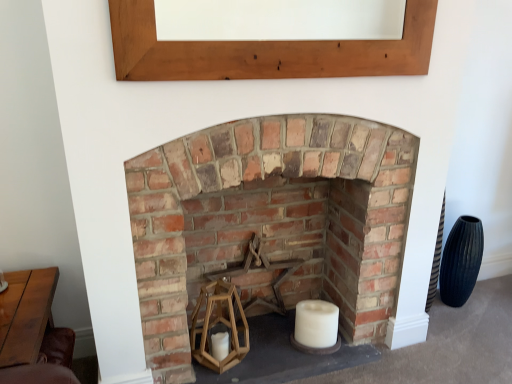
What is the approximate height of rustic brick fireplace at center?

3.91 feet.

Where is `white matte candle at center`? Image resolution: width=512 pixels, height=384 pixels. white matte candle at center is located at coordinates (316, 324).

Measure the distance between point [249,271] and camera.

2.21 meters.

The image size is (512, 384). What do you see at coordinates (260, 271) in the screenshot?
I see `wooden at center` at bounding box center [260, 271].

This screenshot has height=384, width=512. Identify the location of light brown wood at upper center. (264, 51).

From the image's perspective, which one is positioned lower, white matte candle at center or light brown wood at upper center?

white matte candle at center appears lower in the image.

Is white matte candle at center spatially inside light brown wood at upper center, or outside of it?

white matte candle at center exists outside the volume of light brown wood at upper center.

Measure the distance between white matte candle at center and light brown wood at upper center.

A distance of 3.98 feet exists between white matte candle at center and light brown wood at upper center.

Looking at their sizes, would you say white matte candle at center is wider or thinner than light brown wood at upper center?

Considering their sizes, white matte candle at center looks broader than light brown wood at upper center.

From the image's perspective, does rustic brick fireplace at center appear higher than light brown wood at upper center?

Incorrect, from the image's perspective, rustic brick fireplace at center is lower than light brown wood at upper center.

Considering the relative sizes of rustic brick fireplace at center and light brown wood at upper center in the image provided, is rustic brick fireplace at center shorter than light brown wood at upper center?

Incorrect, the height of rustic brick fireplace at center does not fall short of that of light brown wood at upper center.

Image resolution: width=512 pixels, height=384 pixels. I want to click on window frame lying on the right of rustic brick fireplace at center, so click(264, 51).

In the image, is wooden at center on the left side or the right side of rustic brick fireplace at center?

From the image, it's evident that wooden at center is to the left of rustic brick fireplace at center.

Is wooden at center bigger or smaller than rustic brick fireplace at center?

Considering their sizes, wooden at center takes up less space than rustic brick fireplace at center.

Could you tell me if wooden at center is facing rustic brick fireplace at center?

Yes, wooden at center is turned towards rustic brick fireplace at center.

Where is `armchair located underneath the rustic brick fireplace at center (from a real-world perspective)`? The width and height of the screenshot is (512, 384). armchair located underneath the rustic brick fireplace at center (from a real-world perspective) is located at coordinates (260, 271).

Considering the sizes of objects wooden at center and light brown wood at upper center in the image provided, who is shorter, wooden at center or light brown wood at upper center?

Standing shorter between the two is light brown wood at upper center.

This screenshot has width=512, height=384. Find the location of `armchair that is behind the light brown wood at upper center`. armchair that is behind the light brown wood at upper center is located at coordinates (260, 271).

Between wooden at center and light brown wood at upper center, which one has smaller width?

With smaller width is light brown wood at upper center.

Which is more to the right, wooden at center or light brown wood at upper center?

light brown wood at upper center.

From a real-world perspective, is wooden table at lower left under wooden at center?

No, from a real-world perspective, wooden table at lower left is not below wooden at center.

Is wooden table at lower left positioned with its back to wooden at center?

No.

In terms of width, does wooden table at lower left look wider or thinner when compared to wooden at center?

Clearly, wooden table at lower left has more width compared to wooden at center.

Is wooden at center located within wooden table at lower left?

No, wooden at center is not surrounded by wooden table at lower left.

Can you confirm if wooden table at lower left is taller than light brown wood at upper center?

Yes, wooden table at lower left is taller than light brown wood at upper center.

Do you think wooden table at lower left is within light brown wood at upper center, or outside of it?

wooden table at lower left exists outside the volume of light brown wood at upper center.

Considering the sizes of wooden table at lower left and light brown wood at upper center in the image, is wooden table at lower left wider or thinner than light brown wood at upper center?

In the image, wooden table at lower left appears to be wider than light brown wood at upper center.

Locate an element on the screen. The width and height of the screenshot is (512, 384). window frame to the right of wooden table at lower left is located at coordinates (264, 51).

Is the depth of white matte candle at center less than that of rustic brick fireplace at center?

That is False.

The height and width of the screenshot is (384, 512). What are the coordinates of `candle beneath the rustic brick fireplace at center (from a real-world perspective)` in the screenshot? It's located at (316, 324).

Which of these two, white matte candle at center or rustic brick fireplace at center, is bigger?

rustic brick fireplace at center is bigger.

In terms of height, does white matte candle at center look taller or shorter compared to rustic brick fireplace at center?

In the image, white matte candle at center appears to be shorter than rustic brick fireplace at center.

Image resolution: width=512 pixels, height=384 pixels. Find the location of `candle that is under the light brown wood at upper center (from a real-world perspective)`. candle that is under the light brown wood at upper center (from a real-world perspective) is located at coordinates (316, 324).

Identify the location of fireplace that is below the light brown wood at upper center (from the image's perspective). (261, 178).

Estimate the real-world distances between objects in this image. Which object is further from wooden table at lower left, rustic brick fireplace at center or white matte candle at center?

Based on the image, white matte candle at center appears to be further to wooden table at lower left.

Estimate the real-world distances between objects in this image. Which object is further from white matte candle at center, light brown wood at upper center or rustic brick fireplace at center?

The object further to white matte candle at center is light brown wood at upper center.

Estimate the real-world distances between objects in this image. Which object is further from wooden at center, light brown wood at upper center or white matte candle at center?

light brown wood at upper center lies further to wooden at center than the other object.

Estimate the real-world distances between objects in this image. Which object is further from wooden table at lower left, white matte candle at center or wooden at center?

white matte candle at center.

Considering their positions, is white matte candle at center positioned closer to light brown wood at upper center than wooden at center?

Based on the image, wooden at center appears to be nearer to light brown wood at upper center.

From the image, which object appears to be nearer to white matte candle at center, light brown wood at upper center or wooden at center?

Based on the image, wooden at center appears to be nearer to white matte candle at center.

Which object lies nearer to the anchor point rustic brick fireplace at center, light brown wood at upper center or wooden at center?

Among the two, light brown wood at upper center is located nearer to rustic brick fireplace at center.

Estimate the real-world distances between objects in this image. Which object is further from wooden at center, rustic brick fireplace at center or white matte candle at center?

The object further to wooden at center is rustic brick fireplace at center.

Locate an element on the screen. Image resolution: width=512 pixels, height=384 pixels. armchair between light brown wood at upper center and white matte candle at center in the up-down direction is located at coordinates (260, 271).

Identify the location of fireplace between wooden table at lower left and white matte candle at center from left to right. (261, 178).

Find the location of a particular element. This screenshot has height=384, width=512. candle between light brown wood at upper center and wooden table at lower left in the up-down direction is located at coordinates (316, 324).

Find the location of a particular element. Image resolution: width=512 pixels, height=384 pixels. fireplace between light brown wood at upper center and white matte candle at center from top to bottom is located at coordinates (261, 178).